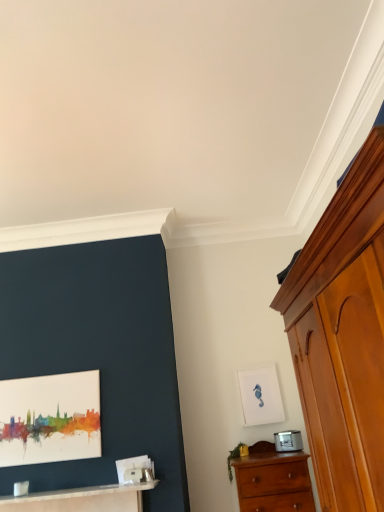
Question: Considering the positions of watercolor paper painting at left, the 2th picture frame when ordered from right to left, and wooden chest of drawers at right, the first chest of drawers positioned from the front, in the image, is watercolor paper painting at left, the 2th picture frame when ordered from right to left, wider or thinner than wooden chest of drawers at right, the first chest of drawers positioned from the front,?

Choices:
 (A) wide
 (B) thin

Answer: (B)

Question: In terms of height, does watercolor paper painting at left, placed as the 1th picture frame when sorted from front to back, look taller or shorter compared to wooden chest of drawers at right, the first chest of drawers positioned from the front?

Choices:
 (A) short
 (B) tall

Answer: (A)

Question: Which object is positioned farthest from the watercolor paper painting at left, arranged as the second picture frame when viewed from the back?

Choices:
 (A) wooden chest of drawers at right, placed as the 2th chest of drawers when sorted from bottom to top
 (B) wooden chest of drawers at lower right, marked as the 2th chest of drawers in a front-to-back arrangement
 (C) white matte picture frame at upper right, which is the 1th picture frame in right-to-left order
 (D) white glossy table at lower left

Answer: (A)

Question: Estimate the real-world distances between objects in this image. Which object is closer to the wooden chest of drawers at right, the first chest of drawers positioned from the front?

Choices:
 (A) white glossy table at lower left
 (B) watercolor paper painting at left, placed as the 1th picture frame when sorted from front to back
 (C) white matte picture frame at upper right, which is the 1th picture frame in right-to-left order
 (D) wooden chest of drawers at lower right, the 2th chest of drawers in the top-to-bottom sequence

Answer: (D)